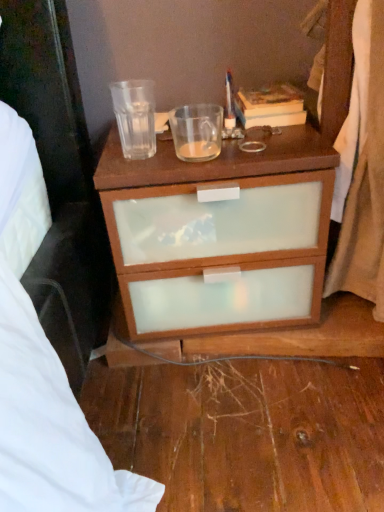
What are the coordinates of `vacant area on top of brown matte drawer at center (from a real-world perspective)` in the screenshot? It's located at (217, 134).